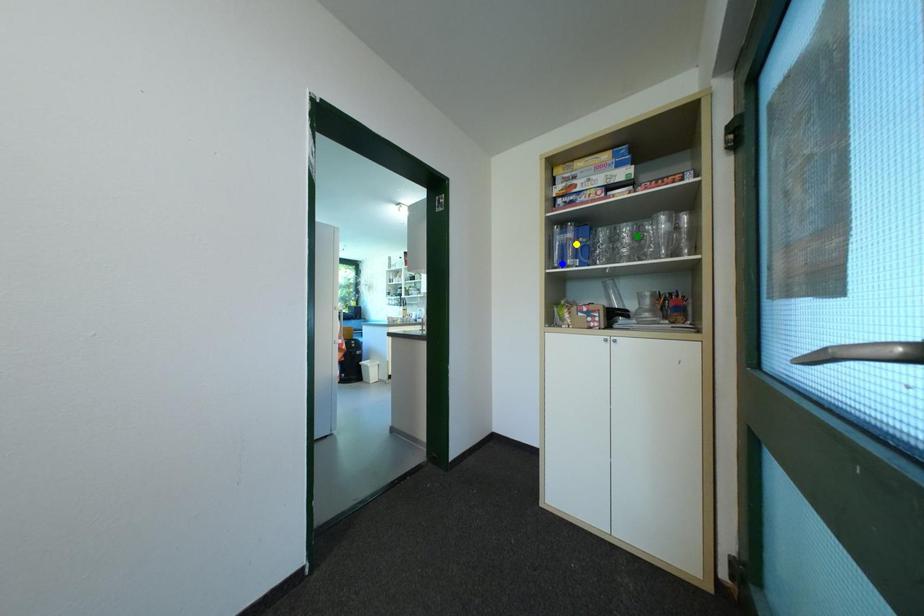
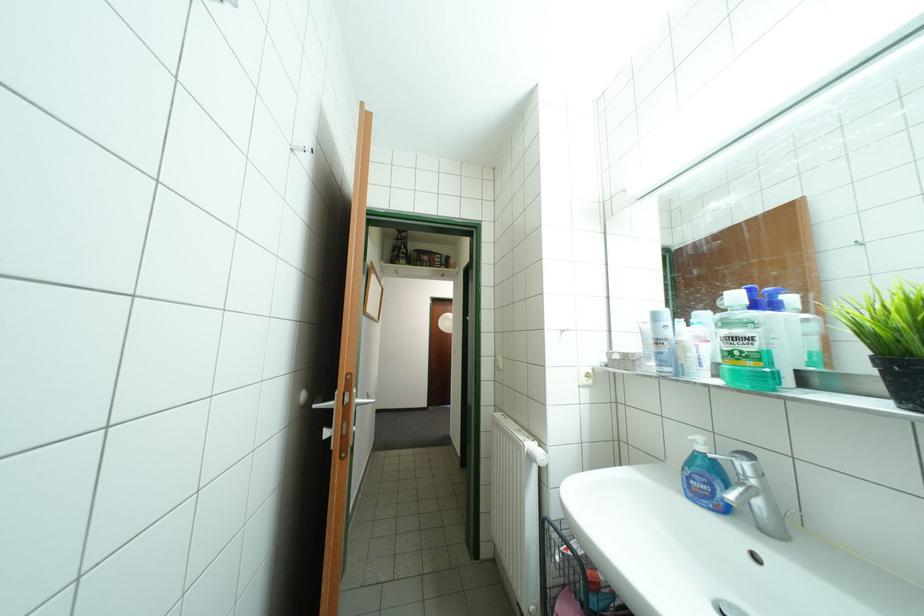
I am providing you with two images of the same scene from different viewpoints. Three points are marked in image1. Which point corresponds to a part or object that is occluded in image2?In image1, three points are marked. Which of them correspond to a part or object that is occluded in image2?Among the three points shown in image1, which one corresponds to a part or object that is no longer visible due to occlusion in image2?

Invisible in image2: blue point, green point, yellow point.